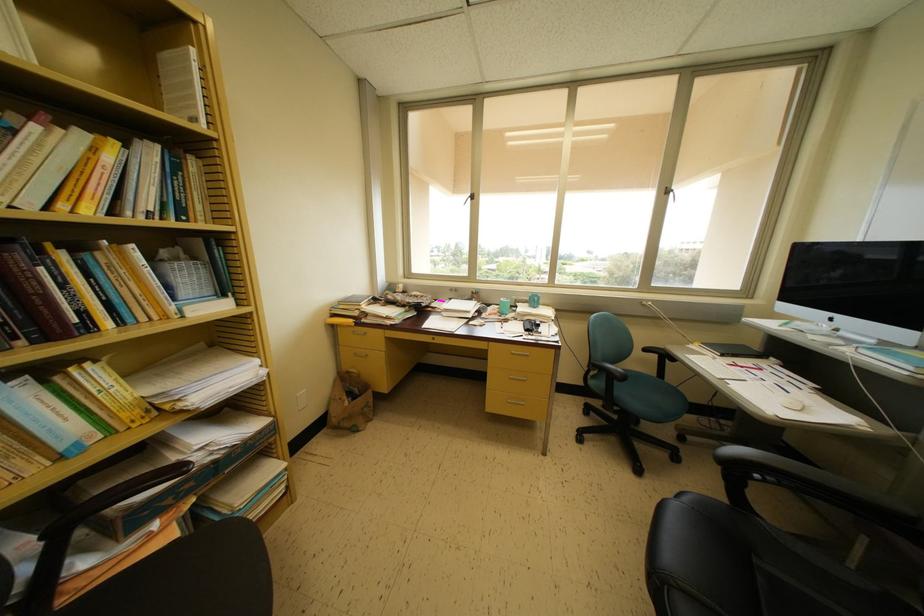
Image resolution: width=924 pixels, height=616 pixels. Describe the element at coordinates (531, 325) in the screenshot. I see `the phone handset` at that location.